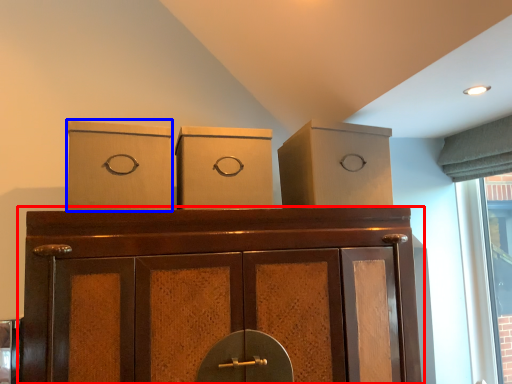
Question: Which of the following is the closest to the observer, cupboard (highlighted by a red box) or cardboard box (highlighted by a blue box)?

Choices:
 (A) cupboard
 (B) cardboard box

Answer: (A)